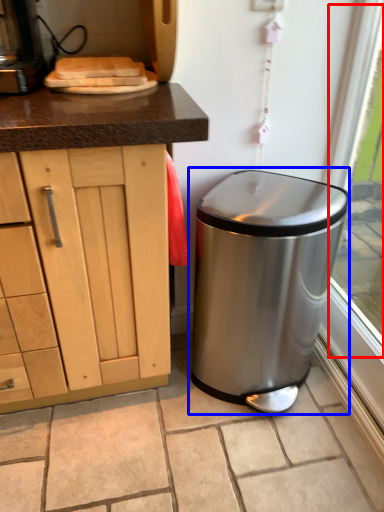
Question: Among these objects, which one is farthest to the camera, window screen (highlighted by a red box) or waste container (highlighted by a blue box)?

Choices:
 (A) window screen
 (B) waste container

Answer: (B)